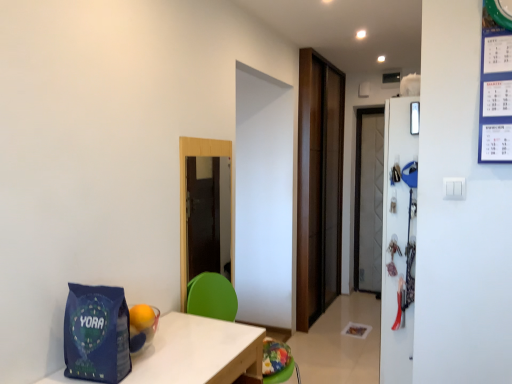
Question: Relative to green plastic chair at center, is blue matte gift bag at lower left in front or behind?

Choices:
 (A) front
 (B) behind

Answer: (A)

Question: Based on their sizes in the image, would you say blue matte gift bag at lower left is bigger or smaller than green plastic chair at center?

Choices:
 (A) small
 (B) big

Answer: (A)

Question: Which object is the farthest from the white glossy refrigerator at right?

Choices:
 (A) blue matte gift bag at lower left
 (B) white wood table at lower left
 (C) brown wood door at center
 (D) transparent wooden door at center
 (E) green plastic chair at center

Answer: (C)

Question: Which object is the closest to the green plastic chair at center?

Choices:
 (A) white wood table at lower left
 (B) transparent wooden door at center
 (C) white glossy refrigerator at right
 (D) brown wood door at center
 (E) blue matte gift bag at lower left

Answer: (B)